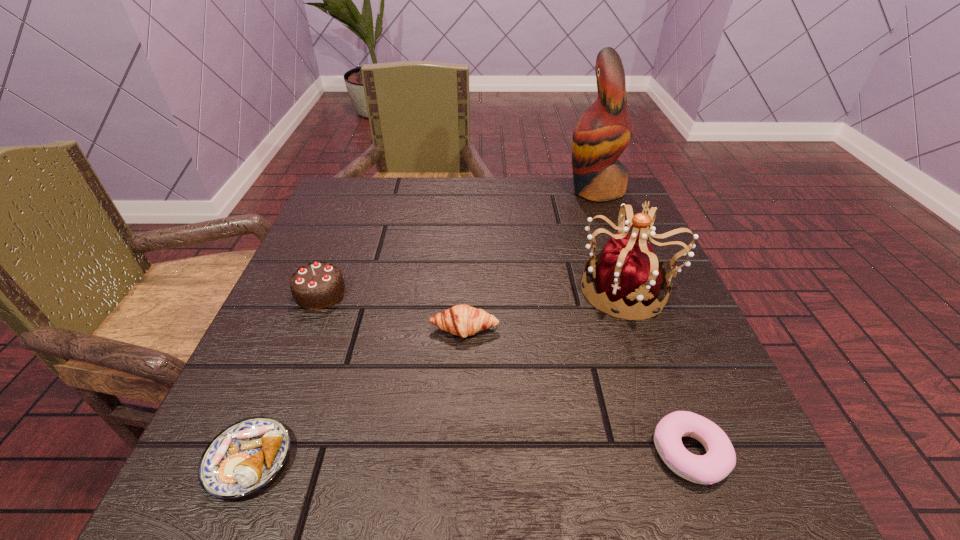
The image size is (960, 540). In order to click on empty space that is in between the rightmost pastry and the farthest pastry in this screenshot , I will do `click(577, 392)`.

I want to click on vacant region between the leftmost pastry and the rightmost pastry, so click(469, 457).

At what (x,y) coordinates should I click in order to perform the action: click on blank region between the tallest object and the rightmost pastry. Please return your answer as a coordinate pair (x, y). The width and height of the screenshot is (960, 540). Looking at the image, I should click on (642, 322).

Locate which object ranks second in proximity to the rightmost pastry. Please provide its 2D coordinates. Your answer should be formatted as a tuple, i.e. [(x, y)], where the tuple contains the x and y coordinates of a point satisfying the conditions above.

[(462, 320)]

Locate which object ranks in proximity to the leftmost pastry. Please provide its 2D coordinates. Your answer should be formatted as a tuple, i.e. [(x, y)], where the tuple contains the x and y coordinates of a point satisfying the conditions above.

[(462, 320)]

Identify the location of pastry that is the third closest to the tiara. (243, 458).

I want to click on pastry that is the second closest to the rightmost pastry, so click(x=243, y=458).

Image resolution: width=960 pixels, height=540 pixels. I want to click on free spot that satisfies the following two spatial constraints: 1. on the front-facing side of the rightmost pastry; 2. on the left side of the farthest pastry, so click(x=460, y=454).

Image resolution: width=960 pixels, height=540 pixels. What are the coordinates of `vacant position in the image that satisfies the following two spatial constraints: 1. on the front-facing side of the tiara; 2. on the front side of the leftmost pastry` in the screenshot? It's located at (691, 460).

At what (x,y) coordinates should I click in order to perform the action: click on free space in the image that satisfies the following two spatial constraints: 1. on the front-facing side of the second tallest object; 2. on the back side of the rightmost pastry. Please return your answer as a coordinate pair (x, y). The height and width of the screenshot is (540, 960). Looking at the image, I should click on (689, 454).